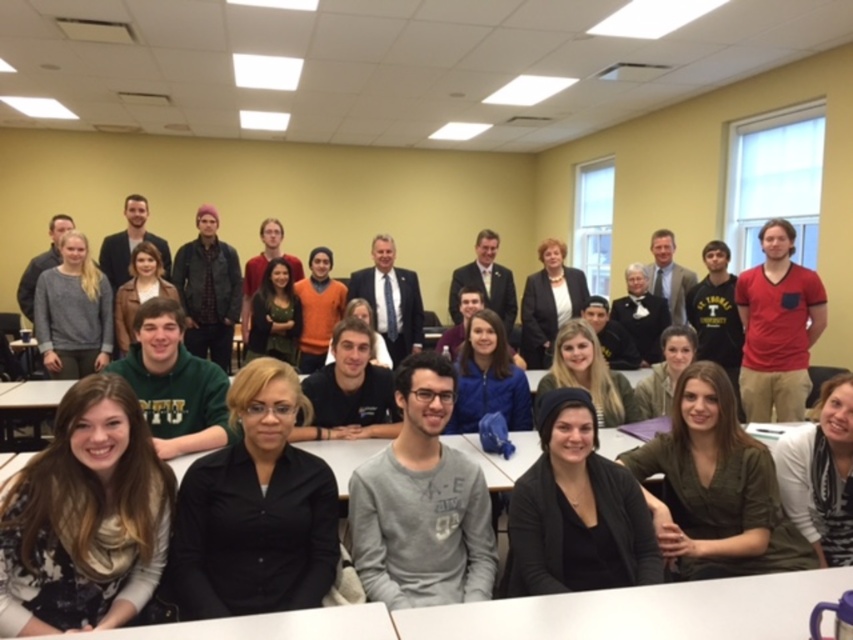
Question: Which point is closer to the camera taking this photo?

Choices:
 (A) coord(64,500)
 (B) coord(399,348)

Answer: (A)

Question: Estimate the real-world distances between objects in this image. Which object is closer to the black button-up shirt at center?

Choices:
 (A) patterned scarf at lower left
 (B) dark gray suit at center
 (C) white plastic table at lower center
 (D) red cotton shirt at right

Answer: (A)

Question: Which point is closer to the camera?

Choices:
 (A) formal suit at center
 (B) matte black blazer at center
 (C) black button-up shirt at center

Answer: (C)

Question: Is patterned scarf at lower left below matte black blazer at center?

Choices:
 (A) yes
 (B) no

Answer: (A)

Question: Is patterned scarf at lower left smaller than matte black jacket at center?

Choices:
 (A) yes
 (B) no

Answer: (A)

Question: Is white plastic table at lower center positioned behind matte black blazer at center?

Choices:
 (A) no
 (B) yes

Answer: (A)